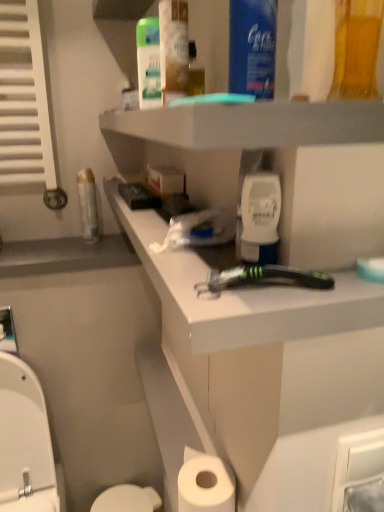
Describe the element at coordinates (173, 48) in the screenshot. Image resolution: width=384 pixels, height=512 pixels. I see `translucent plastic mouthwash at upper center, acting as the 2th mouthwash starting from the left` at that location.

Measure the distance between white glossy toilet bowl at lower left and camera.

The distance of white glossy toilet bowl at lower left from camera is 4.37 feet.

This screenshot has width=384, height=512. What do you see at coordinates (262, 279) in the screenshot? I see `black plastic razor at center` at bounding box center [262, 279].

What do you see at coordinates (26, 443) in the screenshot? The width and height of the screenshot is (384, 512). I see `white plastic toilet seat at lower left` at bounding box center [26, 443].

Image resolution: width=384 pixels, height=512 pixels. What do you see at coordinates (259, 218) in the screenshot?
I see `white matte mouthwash at center, which is the third mouthwash in back-to-front order` at bounding box center [259, 218].

Where is `white matte toilet paper at lower center`? Image resolution: width=384 pixels, height=512 pixels. white matte toilet paper at lower center is located at coordinates (205, 484).

Between translucent plastic mouthwash at upper center, acting as the 2th mouthwash starting from the left, and white plastic toilet seat at lower left, which one has smaller size?

translucent plastic mouthwash at upper center, acting as the 2th mouthwash starting from the left.

From the image's perspective, is translucent plastic mouthwash at upper center, marked as the 4th mouthwash in a right-to-left arrangement, positioned above or below white plastic toilet seat at lower left?

translucent plastic mouthwash at upper center, marked as the 4th mouthwash in a right-to-left arrangement, is situated higher than white plastic toilet seat at lower left in the image.

Is translucent plastic mouthwash at upper center, the fourth mouthwash in the front-to-back sequence, oriented away from white plastic toilet seat at lower left?

No.

Considering the points (242, 218) and (325, 274), which point is in front, point (242, 218) or point (325, 274)?

Point (325, 274)

How distant is white matte mouthwash at center, the fourth mouthwash in the left-to-right sequence, from black plastic razor at center?

They are 5.70 centimeters apart.

The image size is (384, 512). I want to click on tool below the white matte mouthwash at center, which ranks as the 3th mouthwash in front-to-back order (from the image's perspective), so click(262, 279).

Between white matte mouthwash at center, which ranks as the 3th mouthwash in front-to-back order, and black plastic razor at center, which one is positioned in front?

black plastic razor at center is closer to the camera.

Identify the location of toilet paper below the black plastic razor at center (from the image's perspective). The width and height of the screenshot is (384, 512). (205, 484).

In the scene shown: Between black plastic razor at center and white matte toilet paper at lower center, which one appears on the right side from the viewer's perspective?

From the viewer's perspective, black plastic razor at center appears more on the right side.

Is black plastic razor at center looking in the opposite direction of white matte toilet paper at lower center?

black plastic razor at center does not have its back to white matte toilet paper at lower center.

How distant is white matte toilet paper at lower center from black plastic razor at center?

45.68 centimeters.

Is white matte toilet paper at lower center at the right side of black plastic razor at center?

No, white matte toilet paper at lower center is not to the right of black plastic razor at center.

Is white matte toilet paper at lower center inside the boundaries of black plastic razor at center, or outside?

The correct answer is: outside.

From the picture: How different are the orientations of white matte toilet paper at lower center and black plastic razor at center in degrees?

The angle between the facing direction of white matte toilet paper at lower center and the facing direction of black plastic razor at center is 89.2 degrees.

Does white glossy toilet bowl at lower left have a lesser height compared to white plastic toilet seat at lower left?

Yes.

Which of these two, white glossy toilet bowl at lower left or white plastic toilet seat at lower left, is wider?

white plastic toilet seat at lower left.

Would you say white glossy toilet bowl at lower left is outside white plastic toilet seat at lower left?

Yes.

From a real-world perspective, which object rests below the other?

clear plastic bottle at left, the 1th mouthwash viewed from the back.

In the scene shown: Between white matte mouthwash at center, which is the second mouthwash in right-to-left order, and clear plastic bottle at left, the fifth mouthwash when ordered from right to left, which one appears on the right side from the viewer's perspective?

From the viewer's perspective, white matte mouthwash at center, which is the second mouthwash in right-to-left order, appears more on the right side.

Would you say clear plastic bottle at left, the 5th mouthwash viewed from the front, is part of white matte mouthwash at center, which is the third mouthwash in back-to-front order,'s contents?

That's incorrect, clear plastic bottle at left, the 5th mouthwash viewed from the front, is not inside white matte mouthwash at center, which is the third mouthwash in back-to-front order.

Considering their positions, is white matte mouthwash at center, the fourth mouthwash in the left-to-right sequence, located in front of or behind clear plastic bottle at left, the 1th mouthwash viewed from the back?

Clearly, white matte mouthwash at center, the fourth mouthwash in the left-to-right sequence, is in front of clear plastic bottle at left, the 1th mouthwash viewed from the back.

Who is taller, translucent plastic mouthwash at upper center, marked as the 4th mouthwash in a right-to-left arrangement, or translucent yellow liquid at upper right, the 5th mouthwash from the back?

With more height is translucent yellow liquid at upper right, the 5th mouthwash from the back.

You are a GUI agent. You are given a task and a screenshot of the screen. Output one action in this format:
    pyautogui.click(x=<x>, y=<y>)
    Task: Click on the 1st mouthwash positioned below the translucent yellow liquid at upper right, the 5th mouthwash positioned from the left (from a real-world perspective)
    The height and width of the screenshot is (512, 384).
    Given the screenshot: What is the action you would take?
    pyautogui.click(x=173, y=48)

From a real-world perspective, which object rests below the other?

In real-world perspective, translucent plastic mouthwash at upper center, acting as the 2th mouthwash starting from the left, is lower.

Is translucent plastic mouthwash at upper center, the 2th mouthwash viewed from the back, oriented towards translucent yellow liquid at upper right, the 5th mouthwash from the back?

No, translucent plastic mouthwash at upper center, the 2th mouthwash viewed from the back, is not turned towards translucent yellow liquid at upper right, the 5th mouthwash from the back.

The image size is (384, 512). In order to click on the 2nd mouthwash to the right of the white plastic toilet seat at lower left, counting from the anchor's position in this screenshot , I will do `click(173, 48)`.

This screenshot has width=384, height=512. I want to click on tool below the white matte mouthwash at center, which ranks as the 3th mouthwash in front-to-back order (from a real-world perspective), so click(262, 279).

Based on their spatial positions, is white plastic toilet seat at lower left or black plastic razor at center closer to white plastic razor at center?

black plastic razor at center lies closer to white plastic razor at center than the other object.

Estimate the real-world distances between objects in this image. Which object is further from translucent plastic mouthwash at upper center, acting as the 2th mouthwash starting from the left, clear plastic bottle at left, the 1th mouthwash viewed from the back, or blue plastic mouthwash at upper center, placed as the second mouthwash when sorted from front to back?

The object further to translucent plastic mouthwash at upper center, acting as the 2th mouthwash starting from the left, is clear plastic bottle at left, the 1th mouthwash viewed from the back.

Estimate the real-world distances between objects in this image. Which object is closer to white matte mouthwash at center, which is the third mouthwash in back-to-front order, clear plastic bottle at left, the 5th mouthwash viewed from the front, or white plastic razor at center?

white plastic razor at center.

Looking at the image, which one is located further to blue plastic mouthwash at upper center, placed as the second mouthwash when sorted from front to back, white glossy toilet bowl at lower left or clear plastic bottle at left, the fifth mouthwash when ordered from right to left?

Among the two, white glossy toilet bowl at lower left is located further to blue plastic mouthwash at upper center, placed as the second mouthwash when sorted from front to back.

When comparing their distances from white plastic razor at center, does white matte mouthwash at center, which ranks as the 3th mouthwash in front-to-back order, or translucent yellow liquid at upper right, arranged as the 1th mouthwash when viewed from the front, seem further?

Among the two, translucent yellow liquid at upper right, arranged as the 1th mouthwash when viewed from the front, is located further to white plastic razor at center.

Estimate the real-world distances between objects in this image. Which object is further from clear plastic bottle at left, the 5th mouthwash viewed from the front, blue plastic mouthwash at upper center, placed as the 4th mouthwash when sorted from back to front, or white glossy toilet bowl at lower left?

white glossy toilet bowl at lower left lies further to clear plastic bottle at left, the 5th mouthwash viewed from the front, than the other object.

Looking at the image, which one is located further to translucent yellow liquid at upper right, which appears as the 1th mouthwash when viewed from the right, white matte toilet paper at lower center or white plastic razor at center?

Among the two, white matte toilet paper at lower center is located further to translucent yellow liquid at upper right, which appears as the 1th mouthwash when viewed from the right.

Looking at the image, which one is located closer to white plastic razor at center, translucent yellow liquid at upper right, which appears as the 1th mouthwash when viewed from the right, or translucent plastic mouthwash at upper center, acting as the 2th mouthwash starting from the left?

The object closer to white plastic razor at center is translucent plastic mouthwash at upper center, acting as the 2th mouthwash starting from the left.

The width and height of the screenshot is (384, 512). In order to click on tool between white plastic razor at center and clear plastic bottle at left, the 1th mouthwash viewed from the back, along the z-axis in this screenshot , I will do `click(262, 279)`.

Locate an element on the screen. The height and width of the screenshot is (512, 384). toilet paper between clear plastic bottle at left, the 5th mouthwash viewed from the front, and white plastic toilet seat at lower left from top to bottom is located at coordinates (205, 484).

The width and height of the screenshot is (384, 512). Find the location of `sit between translucent yellow liquid at upper right, the 5th mouthwash positioned from the left, and white glossy toilet bowl at lower left in the up-down direction`. sit between translucent yellow liquid at upper right, the 5th mouthwash positioned from the left, and white glossy toilet bowl at lower left in the up-down direction is located at coordinates (26, 443).

You are a GUI agent. You are given a task and a screenshot of the screen. Output one action in this format:
    pyautogui.click(x=<x>, y=<y>)
    Task: Click on the counter top between translucent plastic mouthwash at upper center, the 2th mouthwash viewed from the back, and white matte mouthwash at center, which is the second mouthwash in right-to-left order, vertically
    The width and height of the screenshot is (384, 512).
    Given the screenshot: What is the action you would take?
    pyautogui.click(x=260, y=374)